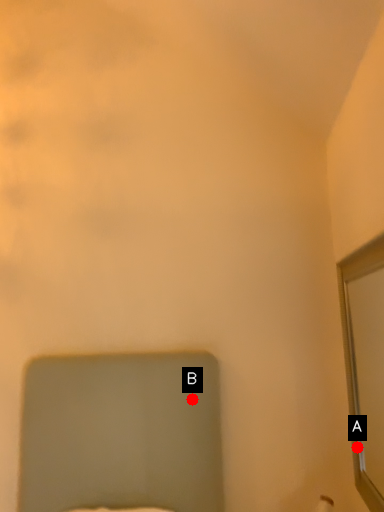
Question: Two points are circled on the image, labeled by A and B beside each circle. Which point is further to the camera?

Choices:
 (A) A is further
 (B) B is further

Answer: (B)